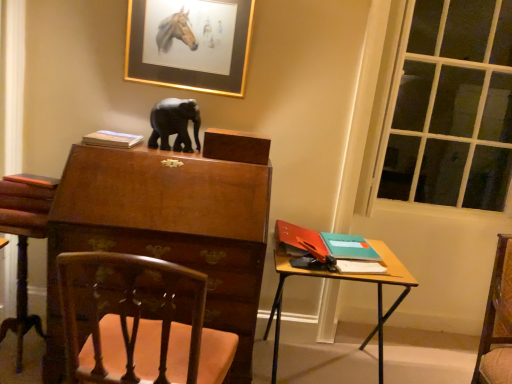
Question: Can you confirm if transparent glass window at right is thinner than wooden carved chair at lower left?

Choices:
 (A) yes
 (B) no

Answer: (A)

Question: Is transparent glass window at right positioned in front of wooden carved chair at lower left?

Choices:
 (A) no
 (B) yes

Answer: (A)

Question: Can you see transparent glass window at right touching wooden carved chair at lower left?

Choices:
 (A) no
 (B) yes

Answer: (A)

Question: Would you say transparent glass window at right is outside wooden carved chair at lower left?

Choices:
 (A) no
 (B) yes

Answer: (B)

Question: Can you confirm if transparent glass window at right is smaller than wooden carved chair at lower left?

Choices:
 (A) no
 (B) yes

Answer: (B)

Question: Does transparent glass window at right have a larger size compared to wooden carved chair at lower left?

Choices:
 (A) yes
 (B) no

Answer: (B)

Question: Does wooden carved chair at lower left appear on the left side of wooden desk at right?

Choices:
 (A) yes
 (B) no

Answer: (A)

Question: Considering the relative sizes of wooden carved chair at lower left and wooden desk at right in the image provided, is wooden carved chair at lower left smaller than wooden desk at right?

Choices:
 (A) yes
 (B) no

Answer: (A)

Question: Is wooden carved chair at lower left next to wooden desk at right and touching it?

Choices:
 (A) no
 (B) yes

Answer: (A)

Question: From a real-world perspective, is wooden carved chair at lower left under wooden desk at right?

Choices:
 (A) yes
 (B) no

Answer: (A)

Question: Is wooden desk at right at the back of wooden carved chair at lower left?

Choices:
 (A) yes
 (B) no

Answer: (B)

Question: Does wooden carved chair at lower left lie behind wooden desk at right?

Choices:
 (A) yes
 (B) no

Answer: (A)

Question: Is matte paper book at upper left, the 1th book when ordered from left to right, bigger than transparent glass window at right?

Choices:
 (A) no
 (B) yes

Answer: (A)